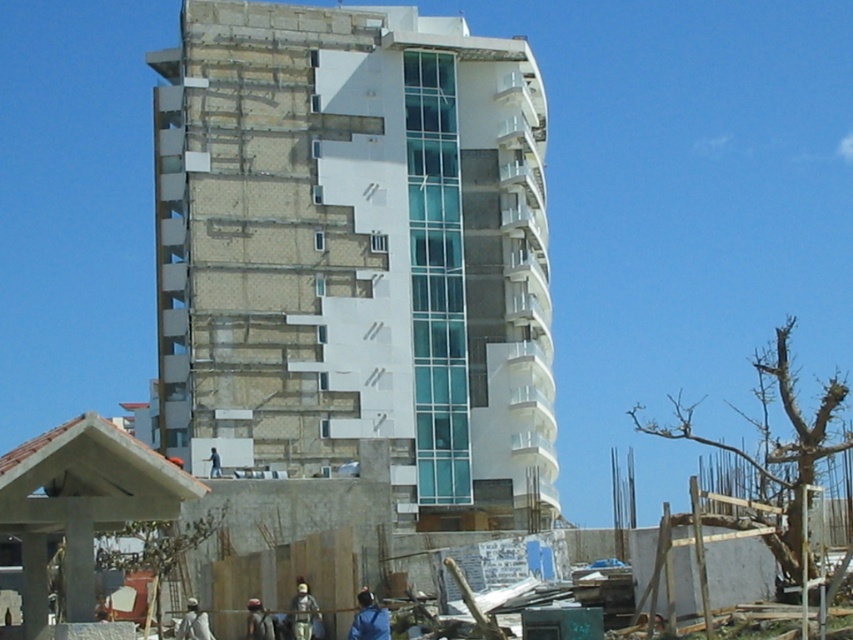
Which is behind, point (190, 632) or point (248, 602)?

Positioned behind is point (248, 602).

Is white fabric at lower center smaller than light brown leather jacket at lower center?

Incorrect, white fabric at lower center is not smaller in size than light brown leather jacket at lower center.

Is point (204, 611) more distant than point (248, 605)?

Yes, it is.

This screenshot has width=853, height=640. I want to click on white fabric at lower center, so click(193, 621).

In the scene shown: Which of these two, light brown fabric jacket at lower center or blue fabric person at center, stands taller?

light brown fabric jacket at lower center is taller.

Can you confirm if light brown fabric jacket at lower center is smaller than blue fabric person at center?

Actually, light brown fabric jacket at lower center might be larger than blue fabric person at center.

Where is `light brown fabric jacket at lower center`? Image resolution: width=853 pixels, height=640 pixels. light brown fabric jacket at lower center is located at coordinates [303, 612].

Identify the location of light brown fabric jacket at lower center. This screenshot has height=640, width=853. (303, 612).

Between point (196, 611) and point (210, 461), which one is positioned behind?

The point (210, 461) is more distant.

Measure the distance from white fabric at lower center to blue fabric person at center.

30.40 meters

The height and width of the screenshot is (640, 853). What do you see at coordinates (193, 621) in the screenshot?
I see `white fabric at lower center` at bounding box center [193, 621].

Identify the location of white fabric at lower center. (193, 621).